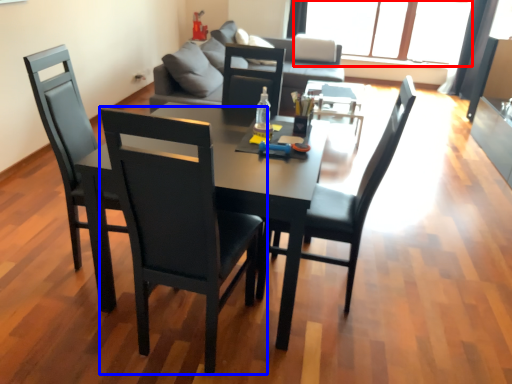
Question: Among these objects, which one is farthest to the camera, window (highlighted by a red box) or chair (highlighted by a blue box)?

Choices:
 (A) window
 (B) chair

Answer: (A)